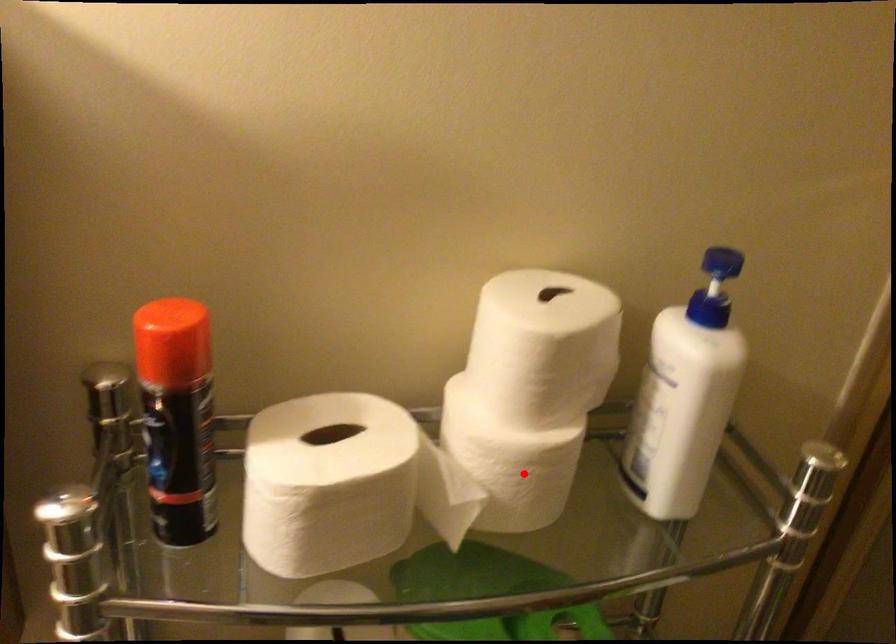
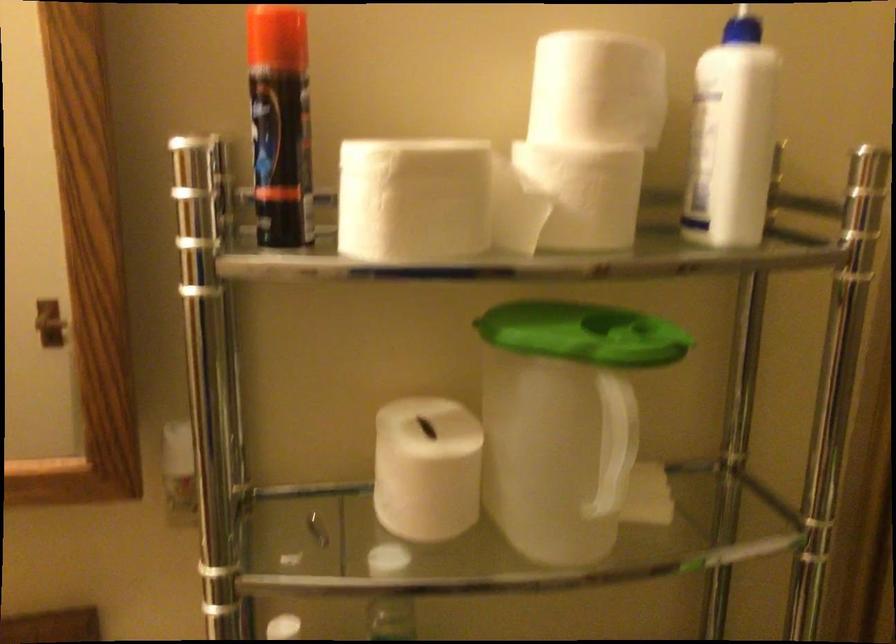
In the second image, find the point that corresponds to the highlighted location in the first image.

(588, 194)